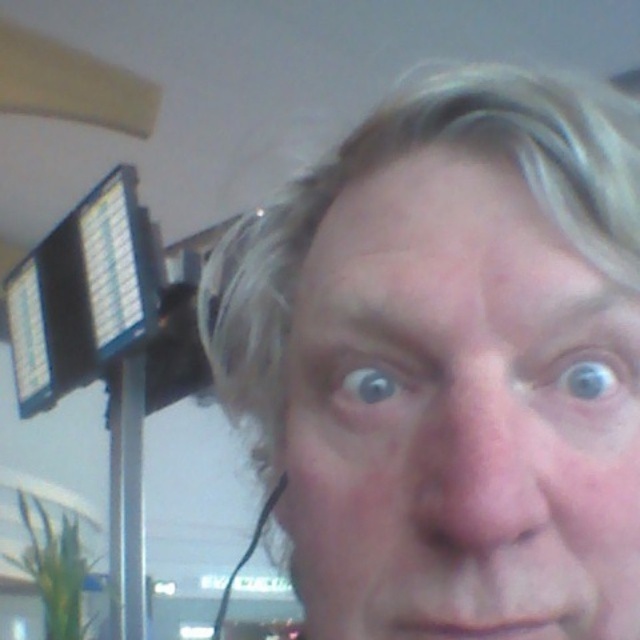
Question: Which object is farther from the camera taking this photo?

Choices:
 (A) gray matte hair at center
 (B) black glossy monitor at upper left

Answer: (B)

Question: Where is gray matte hair at center located in relation to black glossy monitor at upper left in the image?

Choices:
 (A) below
 (B) above

Answer: (A)

Question: Does gray matte hair at center have a lesser width compared to black glossy monitor at upper left?

Choices:
 (A) no
 (B) yes

Answer: (B)

Question: Which of the following is the farthest from the observer?

Choices:
 (A) black glossy monitor at upper left
 (B) gray matte hair at center

Answer: (A)

Question: Which point is closer to the camera?

Choices:
 (A) (452, 358)
 (B) (125, 250)

Answer: (A)

Question: Can you confirm if gray matte hair at center is positioned to the right of black glossy monitor at upper left?

Choices:
 (A) no
 (B) yes

Answer: (B)